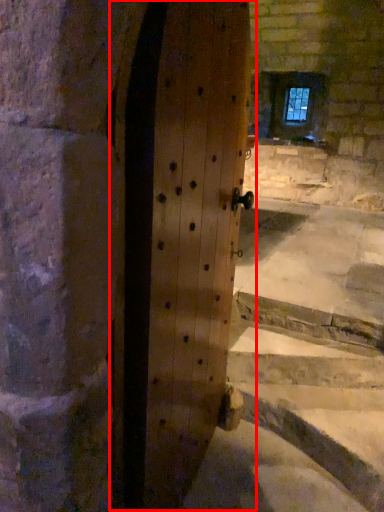
Question: From the image's perspective, considering the relative positions of door (annotated by the red box) and window in the image provided, where is door (annotated by the red box) located with respect to the staircase?

Choices:
 (A) below
 (B) above

Answer: (A)